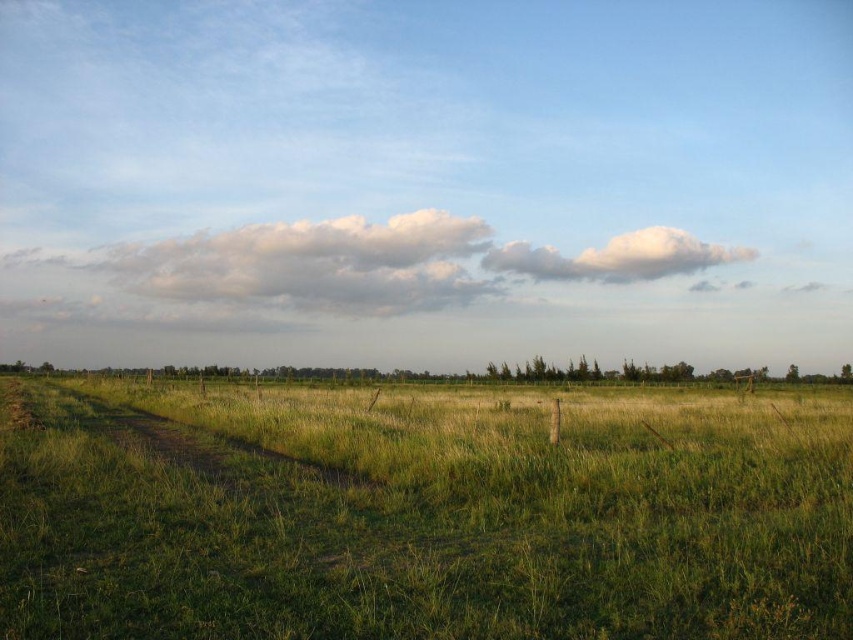
You are standing in the middle of the dirt path and looking towards the green grass at center and the white fluffy cloud at upper center. Which object is nearer to you?

The green grass at center is closer to the viewer than the white fluffy cloud at upper center.

You are standing at the bottom of the image and looking towards the horizon. Which object, the green grass at center or the white fluffy cloud at upper center, is positioned to the left side of the other?

The green grass at center is to the left of the white fluffy cloud at upper center.